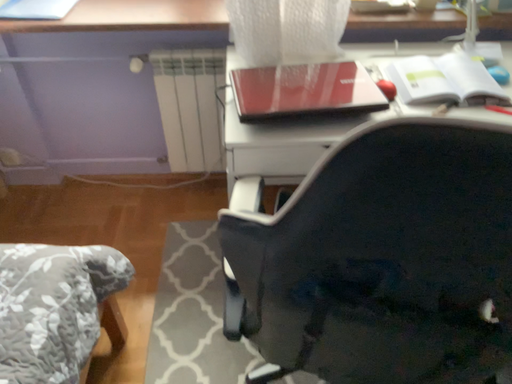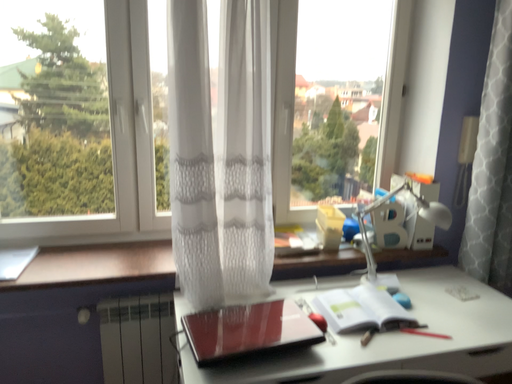
Question: How did the camera likely rotate when shooting the video?

Choices:
 (A) rotated right
 (B) rotated left

Answer: (A)